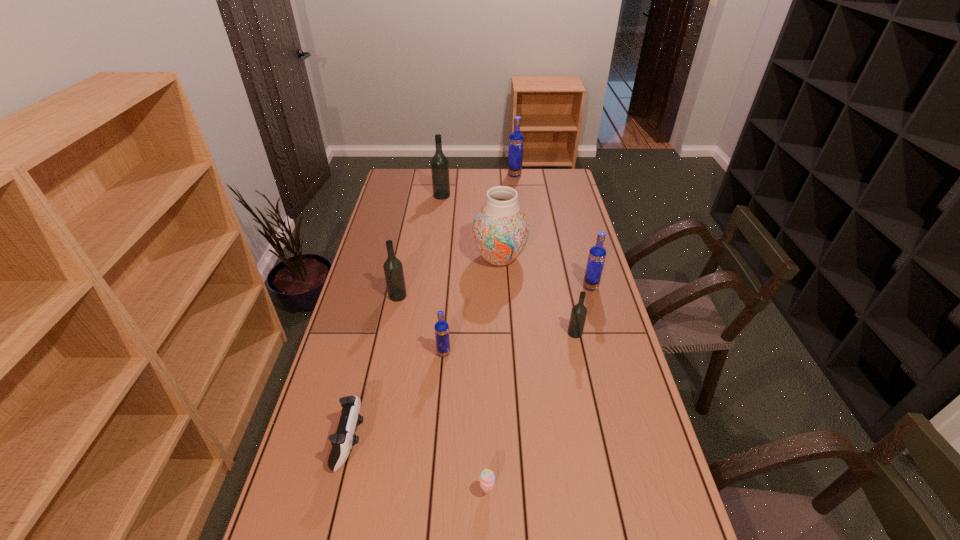
The image size is (960, 540). Find the location of `free spot located 0.080m on the right of the leftmost black vodka`. free spot located 0.080m on the right of the leftmost black vodka is located at coordinates (429, 295).

You are a GUI agent. You are given a task and a screenshot of the screen. Output one action in this format:
    pyautogui.click(x=<x>, y=<y>)
    Task: Click on the vacant position located on the back of the leftmost blue vodka
    The image size is (960, 540).
    Given the screenshot: What is the action you would take?
    pyautogui.click(x=445, y=327)

Identify the location of blank space located 0.130m on the back of the smallest black vodka. The width and height of the screenshot is (960, 540). (568, 301).

At what (x,y) coordinates should I click in order to perform the action: click on vacant space situated 0.180m on the front-facing side of the eighth farthest object. Please return your answer as a coordinate pair (x, y). This screenshot has width=960, height=540. Looking at the image, I should click on (432, 441).

Where is `vacant position located on the back of the nearest object`? Image resolution: width=960 pixels, height=540 pixels. vacant position located on the back of the nearest object is located at coordinates (487, 438).

The width and height of the screenshot is (960, 540). Find the location of `vodka positioned at the left edge`. vodka positioned at the left edge is located at coordinates (393, 269).

Locate an element on the screen. control that is positioned at the left edge is located at coordinates (344, 439).

This screenshot has height=540, width=960. I want to click on vacant point at the far edge, so [x=499, y=178].

Identify the location of blank area at the left edge. This screenshot has width=960, height=540. (382, 275).

Image resolution: width=960 pixels, height=540 pixels. I want to click on free point at the right edge, so click(552, 218).